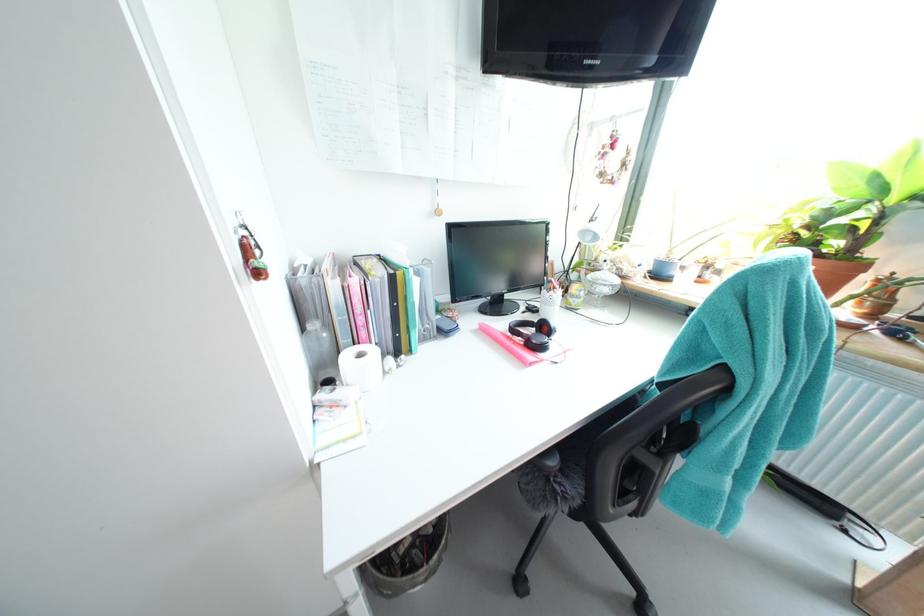
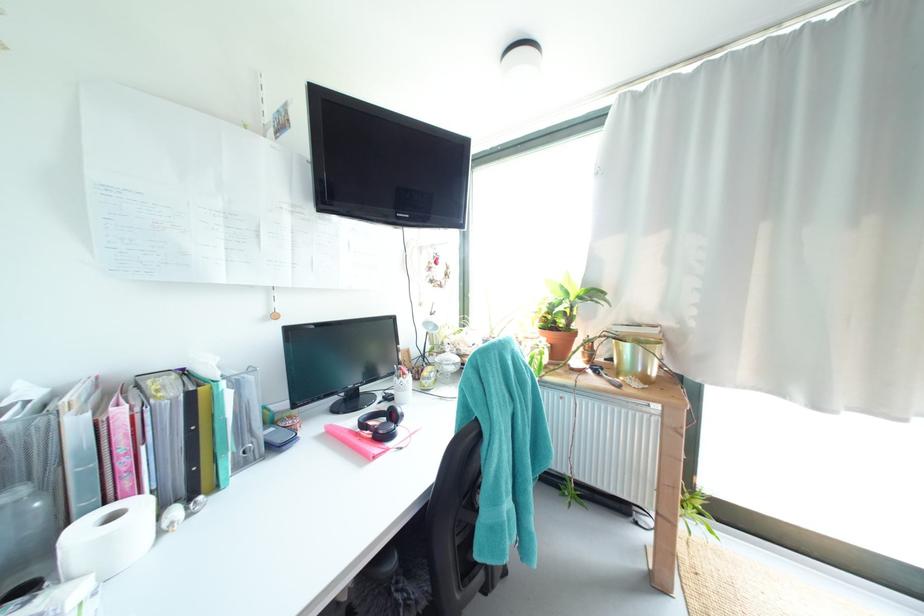
The point at (598, 278) is marked in the first image. Where is the corresponding point in the second image?

(445, 361)